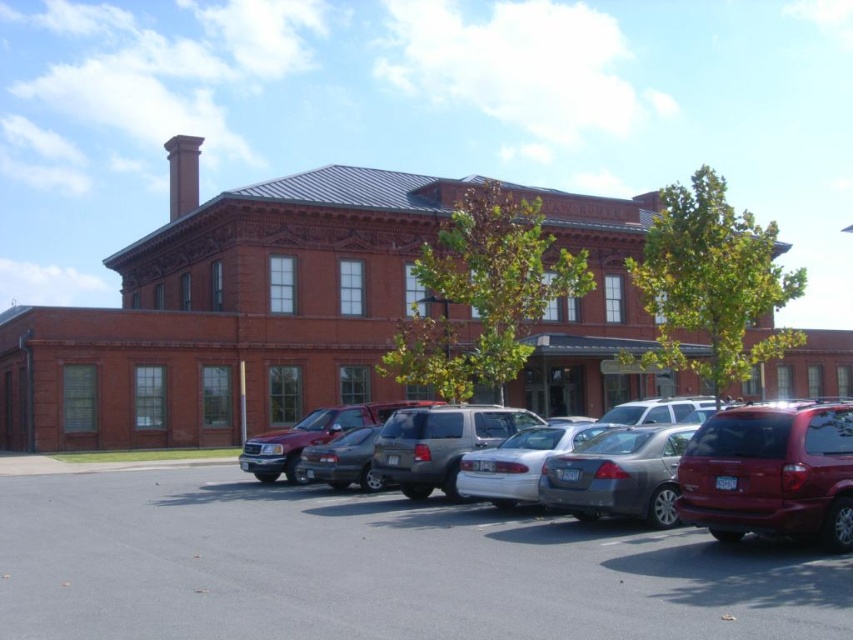
Who is positioned more to the left, gray asphalt parking lot at lower center or glossy red suv at right?

gray asphalt parking lot at lower center

Is gray asphalt parking lot at lower center below glossy red suv at right?

Correct, gray asphalt parking lot at lower center is located below glossy red suv at right.

Identify the location of gray asphalt parking lot at lower center. (376, 568).

Measure the distance between gray asphalt parking lot at lower center and silver metallic suv at center.

They are 4.13 meters apart.

Which is in front, point (747, 557) or point (561, 467)?

Point (747, 557) is in front.

Measure the distance between point (x=233, y=596) and camera.

A distance of 9.04 meters exists between point (x=233, y=596) and camera.

You are a GUI agent. You are given a task and a screenshot of the screen. Output one action in this format:
    pyautogui.click(x=<x>, y=<y>)
    Task: Click on the gray asphalt parking lot at lower center
    
    Given the screenshot: What is the action you would take?
    pyautogui.click(x=376, y=568)

Is gray asphalt parking lot at lower center shorter than red brick chimney at upper left?

Yes.

Is point (665, 598) less distant than point (175, 138)?

Yes, point (665, 598) is closer to viewer.

Locate an element on the screen. The height and width of the screenshot is (640, 853). gray asphalt parking lot at lower center is located at coordinates (376, 568).